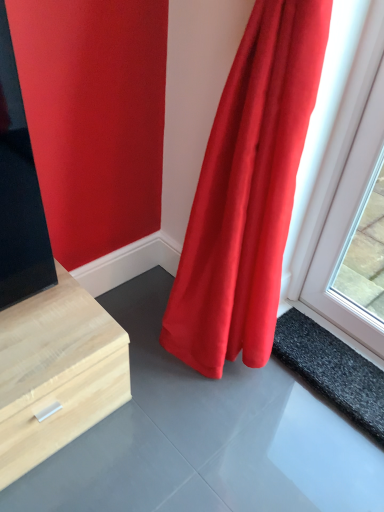
Locate an element on the screen. This screenshot has height=512, width=384. free space that is to the left of matte red curtain at right is located at coordinates (145, 370).